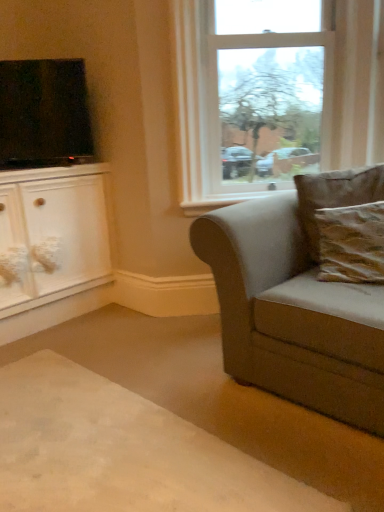
Question: Looking at the image, does clear glass window at upper center seem bigger or smaller compared to carpet at lower left?

Choices:
 (A) small
 (B) big

Answer: (B)

Question: In terms of width, does clear glass window at upper center look wider or thinner when compared to carpet at lower left?

Choices:
 (A) wide
 (B) thin

Answer: (B)

Question: Considering the real-world distances, which object is farthest from the white fabric drawer at lower left?

Choices:
 (A) brown textured pillow at right, which appears as the first pillow when viewed from the back
 (B) clear glass window at upper center
 (C) matte black tv at upper left
 (D) suede-like gray couch at right
 (E) carpet at lower left

Answer: (A)

Question: Which of these objects is positioned closest to the clear glass window at upper center?

Choices:
 (A) carpet at lower left
 (B) suede-like gray couch at right
 (C) matte black tv at upper left
 (D) brown textured pillow at right, which appears as the first pillow when viewed from the back
 (E) white glossy cabinet at left

Answer: (D)